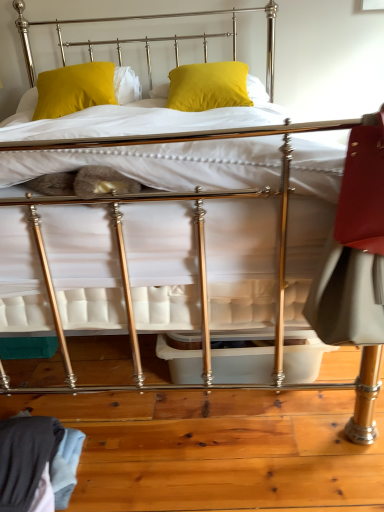
Question: Which direction should I rotate to look at matte yellow pillow at center, which is the 1th pillow from right to left, — up or down?

Choices:
 (A) up
 (B) down

Answer: (A)

Question: From a real-world perspective, is yellow matte pillow at upper center, the second pillow viewed from the right, positioned over matte yellow pillow at center, the 2th pillow when ordered from left to right, based on gravity?

Choices:
 (A) no
 (B) yes

Answer: (B)

Question: Is yellow matte pillow at upper center, the second pillow viewed from the right, outside matte yellow pillow at center, the 2th pillow when ordered from left to right?

Choices:
 (A) no
 (B) yes

Answer: (B)

Question: Does yellow matte pillow at upper center, which appears as the first pillow when viewed from the left, have a greater height compared to matte yellow pillow at center, the 2th pillow when ordered from left to right?

Choices:
 (A) yes
 (B) no

Answer: (A)

Question: Is yellow matte pillow at upper center, which appears as the first pillow when viewed from the left, looking in the opposite direction of matte yellow pillow at center, the 2th pillow when ordered from left to right?

Choices:
 (A) no
 (B) yes

Answer: (A)

Question: From a real-world perspective, does yellow matte pillow at upper center, which appears as the first pillow when viewed from the left, sit lower than matte yellow pillow at center, which is the 1th pillow from right to left?

Choices:
 (A) yes
 (B) no

Answer: (B)

Question: Does yellow matte pillow at upper center, which appears as the first pillow when viewed from the left, have a smaller size compared to matte yellow pillow at center, which is the 1th pillow from right to left?

Choices:
 (A) no
 (B) yes

Answer: (B)

Question: Is matte yellow pillow at center, the 2th pillow when ordered from left to right, wider than yellow matte pillow at upper center, the second pillow viewed from the right?

Choices:
 (A) no
 (B) yes

Answer: (B)

Question: Does matte yellow pillow at center, which is the 1th pillow from right to left, lie behind yellow matte pillow at upper center, the second pillow viewed from the right?

Choices:
 (A) yes
 (B) no

Answer: (B)

Question: Is matte yellow pillow at center, the 2th pillow when ordered from left to right, at the left side of yellow matte pillow at upper center, which appears as the first pillow when viewed from the left?

Choices:
 (A) yes
 (B) no

Answer: (B)

Question: Is matte yellow pillow at center, which is the 1th pillow from right to left, aimed at yellow matte pillow at upper center, which appears as the first pillow when viewed from the left?

Choices:
 (A) no
 (B) yes

Answer: (A)

Question: From the image's perspective, is matte yellow pillow at center, the 2th pillow when ordered from left to right, located beneath yellow matte pillow at upper center, which appears as the first pillow when viewed from the left?

Choices:
 (A) yes
 (B) no

Answer: (B)

Question: Is matte yellow pillow at center, the 2th pillow when ordered from left to right, shorter than yellow matte pillow at upper center, the second pillow viewed from the right?

Choices:
 (A) yes
 (B) no

Answer: (A)

Question: From the image's perspective, is yellow matte pillow at upper center, the second pillow viewed from the right, located above or below matte yellow pillow at center, which is the 1th pillow from right to left?

Choices:
 (A) below
 (B) above

Answer: (A)